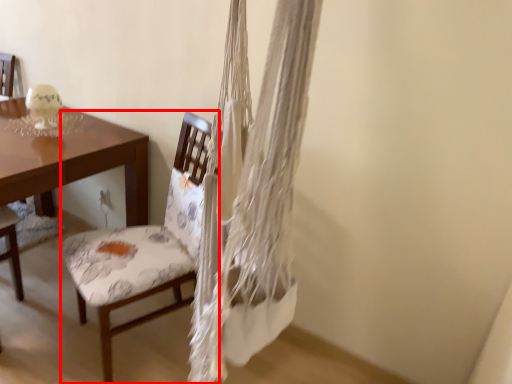
Question: Considering the relative positions of chair (annotated by the red box) and desk in the image provided, where is chair (annotated by the red box) located with respect to the staircase?

Choices:
 (A) left
 (B) right

Answer: (B)